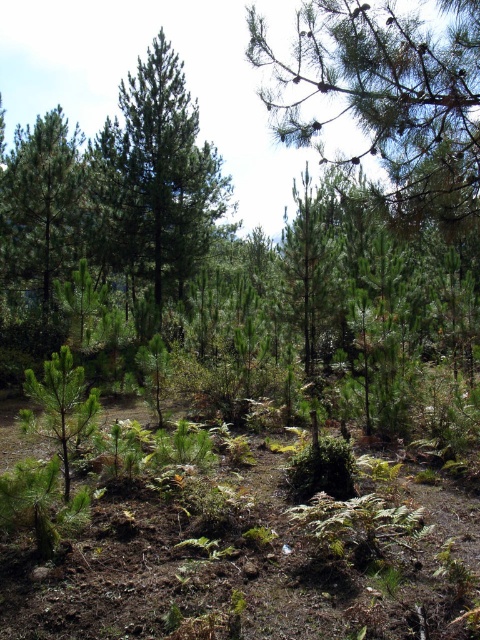
You are a hiker who wants to measure the distance between the two green matte trees in the forest. How far apart are the green matte tree at center and the green matte tree at left?

The green matte tree at center is 7.24 feet away from the green matte tree at left, so the distance between them is 7.24 feet.

You are a hiker trying to navigate through the forest. You see two trees in front of you, the green matte tree at center and the green matte tree at left. Which tree should you approach if you want to find a higher vantage point?

The green matte tree at center is taller than the green matte tree at left, so approaching the green matte tree at center would provide a higher vantage point.